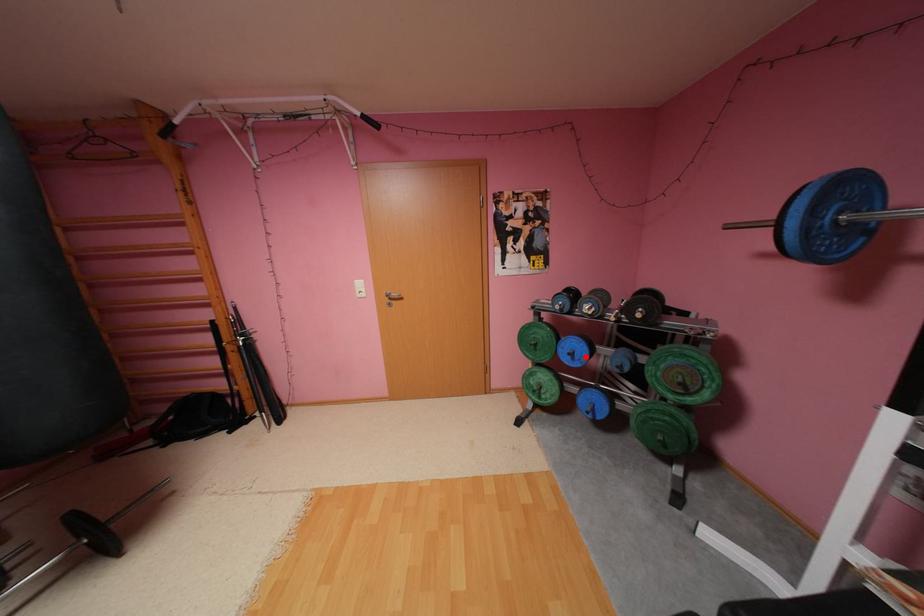
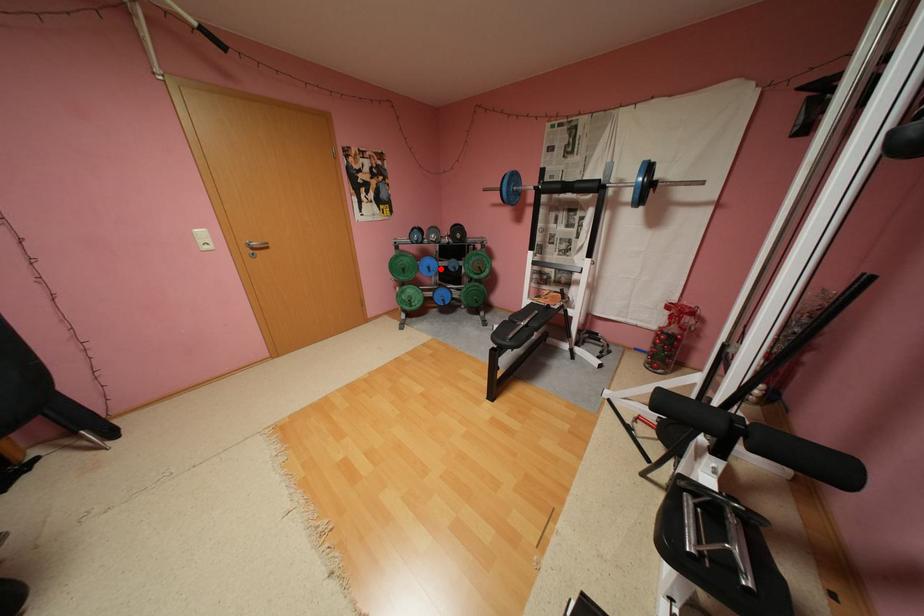
I am providing you with two images of the same scene from different viewpoints. A red point is marked on the first image and another point is marked on the second image. Is the red point in image1 aligned with the point shown in image2?

Yes